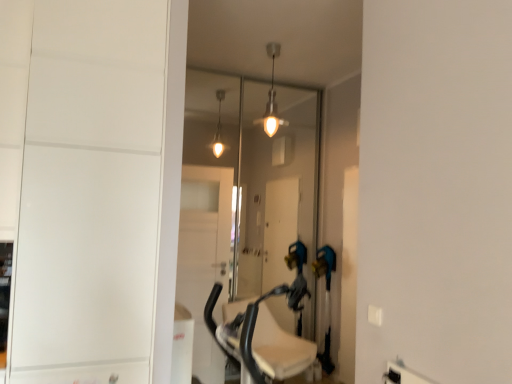
The height and width of the screenshot is (384, 512). I want to click on white matte door at left, so click(x=99, y=193).

The image size is (512, 384). What do you see at coordinates (99, 193) in the screenshot?
I see `white matte door at left` at bounding box center [99, 193].

You are a GUI agent. You are given a task and a screenshot of the screen. Output one action in this format:
    pyautogui.click(x=<x>, y=<y>)
    Task: Click on the white matte door at left
    This screenshot has height=384, width=512.
    Given the screenshot: What is the action you would take?
    pyautogui.click(x=99, y=193)